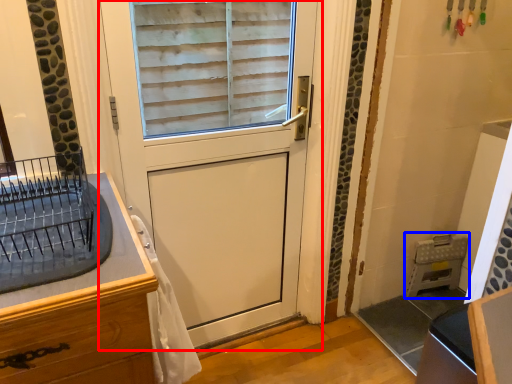
Question: Among these objects, which one is nearest to the camera, door (highlighted by a red box) or appliance (highlighted by a blue box)?

Choices:
 (A) door
 (B) appliance

Answer: (A)